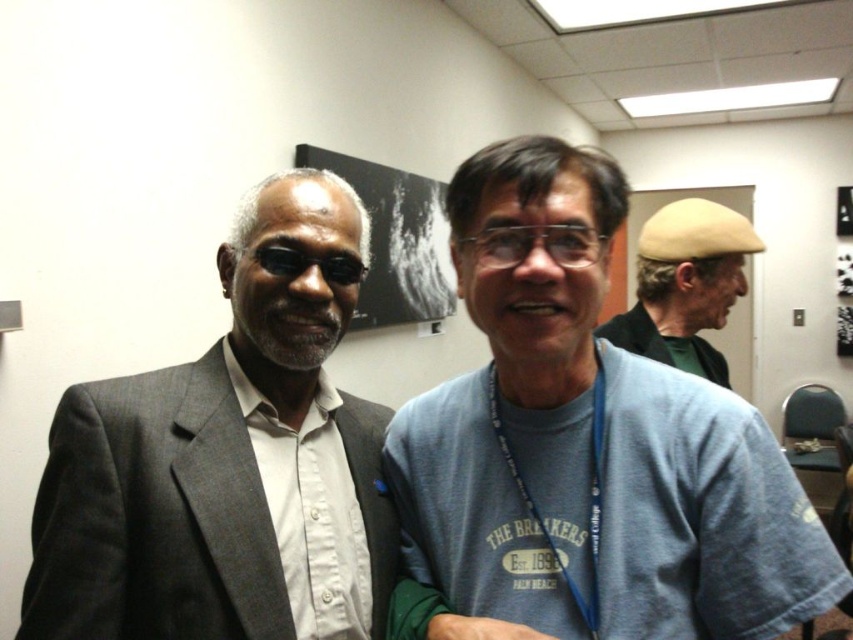
Question: Which is nearer to the matte gray suit at left?

Choices:
 (A) blue cotton t-shirt at center
 (B) beige felt hat at upper right

Answer: (A)

Question: Does blue cotton t-shirt at center have a lesser width compared to beige felt hat at upper right?

Choices:
 (A) yes
 (B) no

Answer: (B)

Question: Is blue cotton t-shirt at center wider than matte gray suit at left?

Choices:
 (A) no
 (B) yes

Answer: (B)

Question: Which of the following is the closest to the observer?

Choices:
 (A) (560, 547)
 (B) (706, 211)
 (C) (112, 465)

Answer: (A)

Question: Which object is positioned closest to the beige felt hat at upper right?

Choices:
 (A) matte gray suit at left
 (B) blue cotton t-shirt at center

Answer: (B)

Question: Can you confirm if blue cotton t-shirt at center is positioned below beige felt hat at upper right?

Choices:
 (A) no
 (B) yes

Answer: (B)